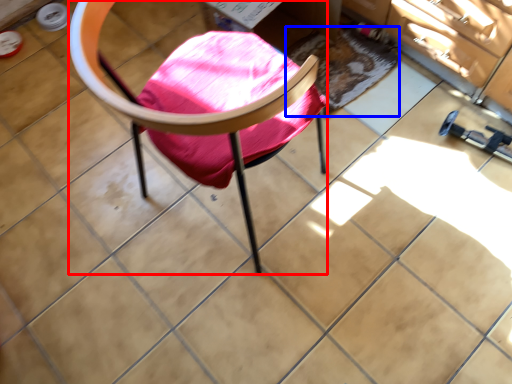
Question: Among these objects, which one is nearest to the camera, chair (highlighted by a red box) or mat (highlighted by a blue box)?

Choices:
 (A) chair
 (B) mat

Answer: (A)